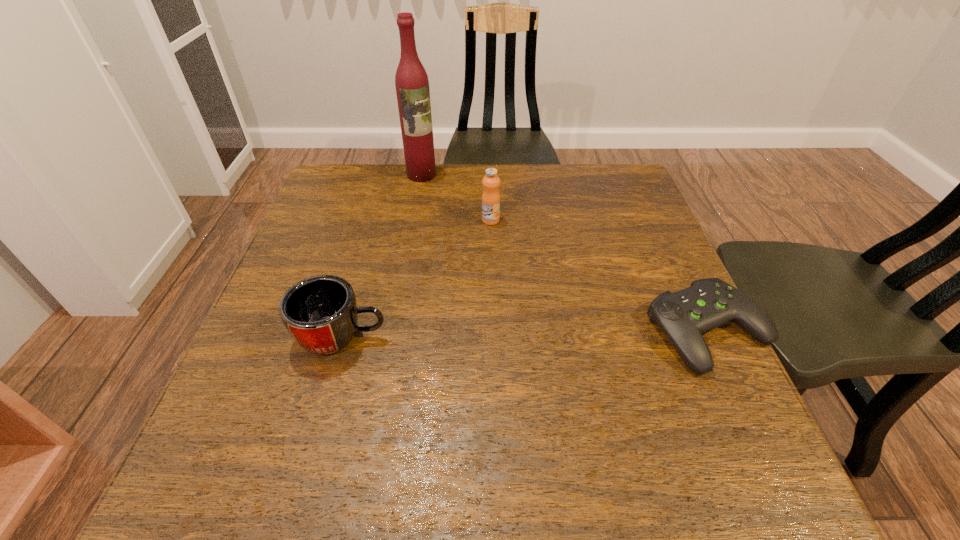
Locate an element on the screen. This screenshot has height=540, width=960. free space on the desktop that is between the second shortest object and the rightmost object and is positioned on the front label of the second farthest object is located at coordinates (487, 334).

Find the location of `free space on the desktop that is between the third tallest object and the control and is positioned on the label of the liquor`. free space on the desktop that is between the third tallest object and the control and is positioned on the label of the liquor is located at coordinates (533, 334).